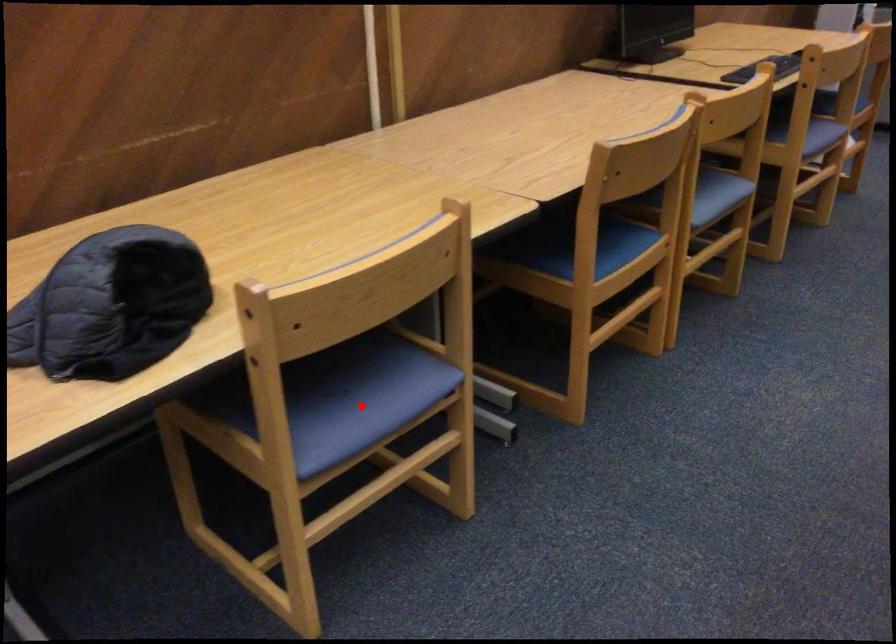
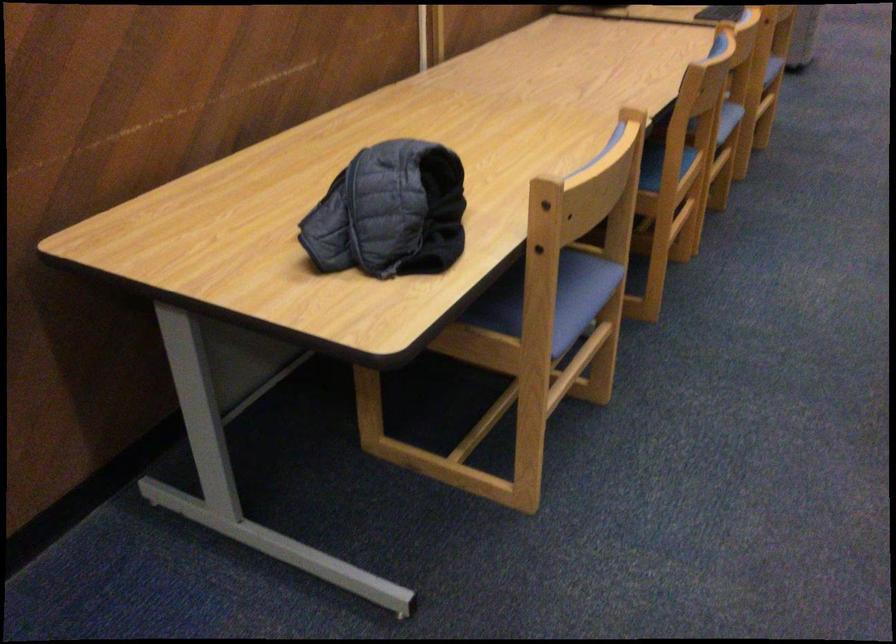
Where in the second image is the point corresponding to the highlighted location from the first image?

(561, 299)